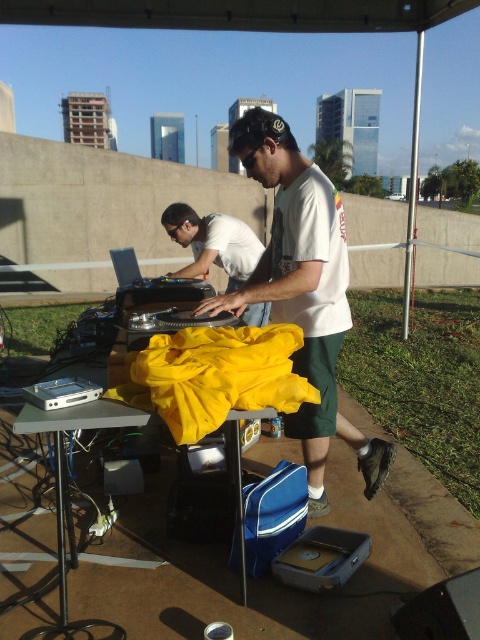
Which is above, white cotton t-shirt at center or white matte shirt at center?

Positioned higher is white matte shirt at center.

Where is `white cotton t-shirt at center`? This screenshot has height=640, width=480. white cotton t-shirt at center is located at coordinates (303, 291).

Locate an element on the screen. This screenshot has width=480, height=640. white cotton t-shirt at center is located at coordinates (303, 291).